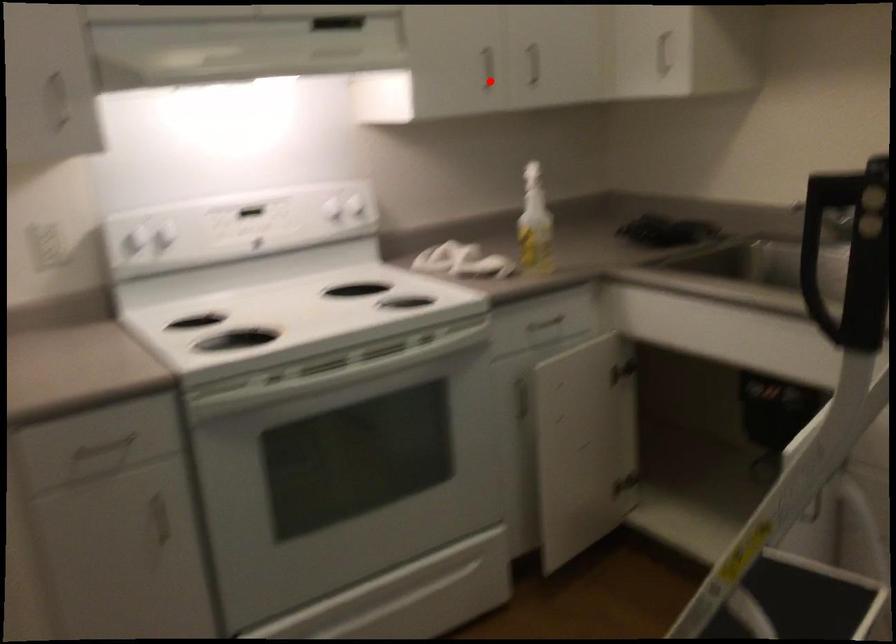
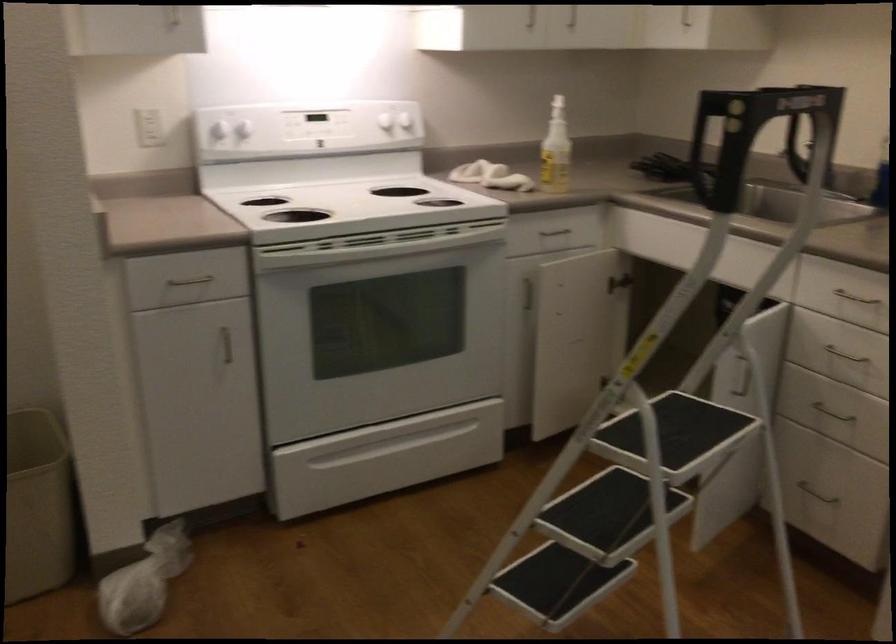
Where in the second image is the point corresponding to the highlighted location from the first image?

(532, 19)